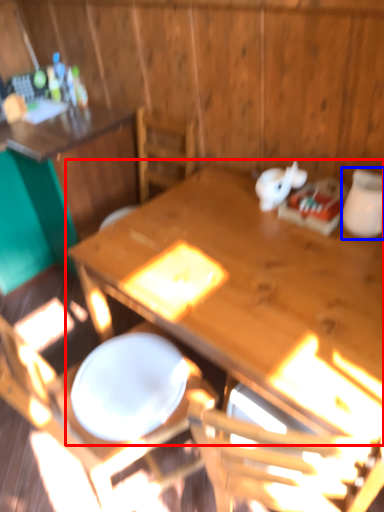
Question: Which object is further to the camera taking this photo, table (highlighted by a red box) or tableware (highlighted by a blue box)?

Choices:
 (A) table
 (B) tableware

Answer: (B)